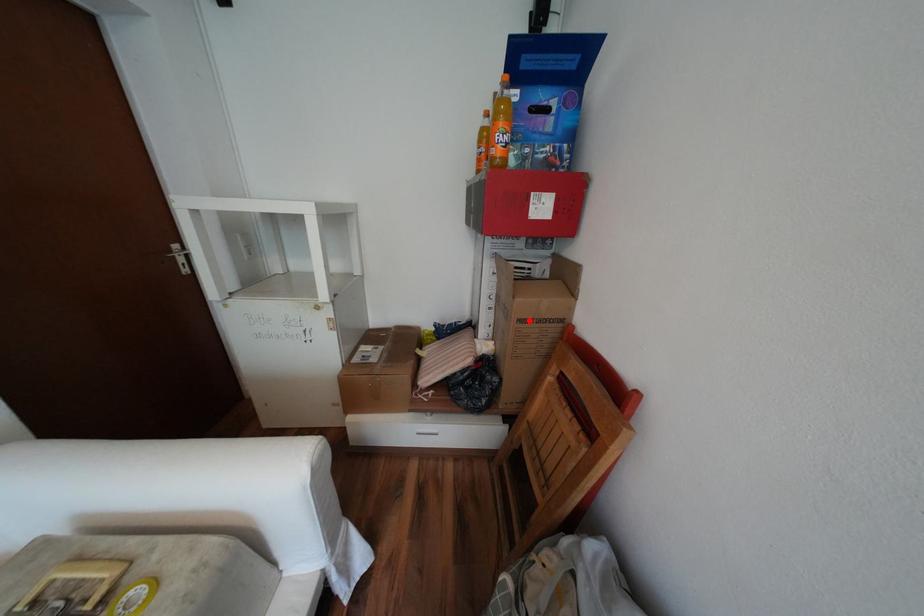
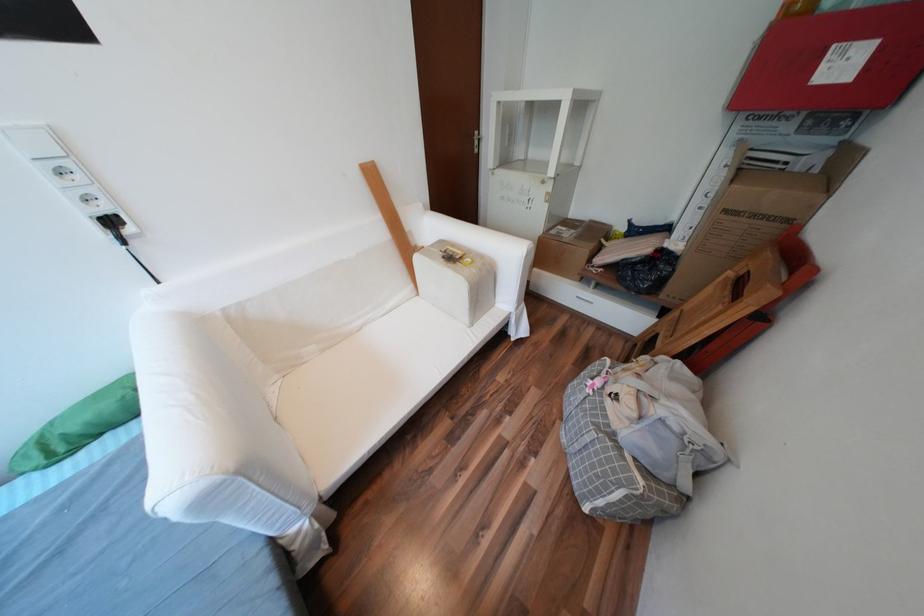
Where in the second image is the point corresponding to the highlighted location from the first image?

(736, 211)